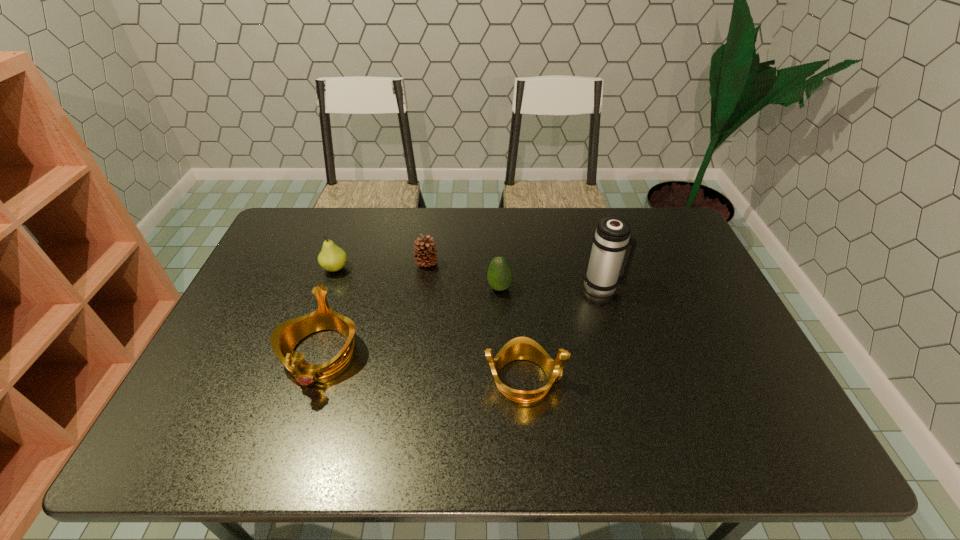
What are the coordinates of `object that is the fifth closest one to the left tiara` in the screenshot? It's located at (611, 238).

At what (x,y) coordinates should I click in order to perform the action: click on free space that satisfies the following two spatial constraints: 1. on the side with the handle of the tallest object; 2. at the front emblem of the left tiara. Please return your answer as a coordinate pair (x, y). The height and width of the screenshot is (540, 960). Looking at the image, I should click on click(x=622, y=354).

Locate an element on the screen. Image resolution: width=960 pixels, height=540 pixels. vacant point that satisfies the following two spatial constraints: 1. on the side with the handle of the tallest object; 2. at the front emblem of the left tiara is located at coordinates (622, 354).

The width and height of the screenshot is (960, 540). I want to click on free region that satisfies the following two spatial constraints: 1. on the side with the handle of the thermos bottle; 2. at the front emblem of the left tiara, so click(x=622, y=354).

At what (x,y) coordinates should I click in order to perform the action: click on vacant point that satisfies the following two spatial constraints: 1. on the front side of the avocado; 2. on the left side of the pear. Please return your answer as a coordinate pair (x, y). This screenshot has height=540, width=960. Looking at the image, I should click on (328, 288).